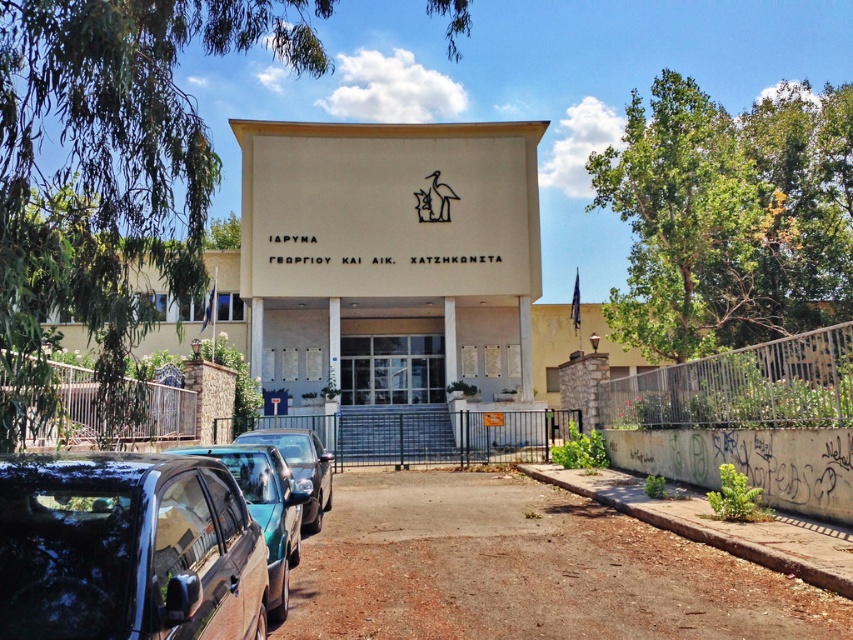
You are standing at point (187,509) and want to reach the entrance of the building. The entrance is 3.34 meters away from your current position. Can you estimate how many steps it would take to reach the entrance if each step covers approximately 0.7 meters?

The entrance is 3.34 meters away from point (187,509). If each step covers 0.7 meters, dividing 3.34 by 0.7 gives approximately 4.77 steps. Since you can only take whole steps, it would take about 5 steps to reach the entrance.

You are a delivery person trying to park your 1.8 meters tall delivery cart between the glossy metallic car at lower left and the metallic blue car at lower left. Can your cart fit vertically between them?

The glossy metallic car at lower left is taller than the metallic blue car at lower left. Since the delivery cart is 1.8 meters tall, it can fit vertically between them as long as the space between the two cars is at least 1.8 meters in height.